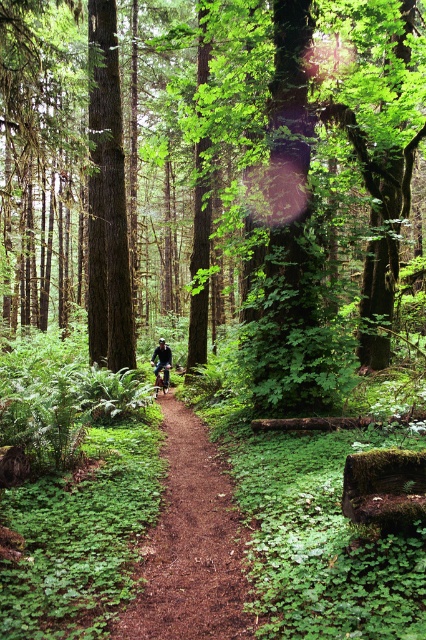
Does black matte bicycle at center have a greater width compared to shiny metallic mountain bike at center?

Yes.

Can you confirm if black matte bicycle at center is taller than shiny metallic mountain bike at center?

Yes.

Who is more distant from viewer, (166, 387) or (161, 371)?

Point (166, 387)

Where is `black matte bicycle at center`? This screenshot has height=640, width=426. black matte bicycle at center is located at coordinates (161, 364).

Who is lower down, brown dirt path at center or shiny metallic mountain bike at center?

brown dirt path at center

Which is in front, point (189, 637) or point (163, 387)?

Point (189, 637) is more forward.

Between point (216, 456) and point (161, 364), which one is positioned behind?

The point (161, 364) is more distant.

The image size is (426, 640). What are the coordinates of `brown dirt path at center` in the screenshot? It's located at (190, 545).

Can you confirm if dark brown wood tree at center is positioned above black matte bicycle at center?

Indeed, dark brown wood tree at center is positioned over black matte bicycle at center.

Is dark brown wood tree at center smaller than black matte bicycle at center?

No, dark brown wood tree at center is not smaller than black matte bicycle at center.

At what (x,y) coordinates should I click in order to perform the action: click on dark brown wood tree at center. Please return your answer as a coordinate pair (x, y). Looking at the image, I should click on (106, 200).